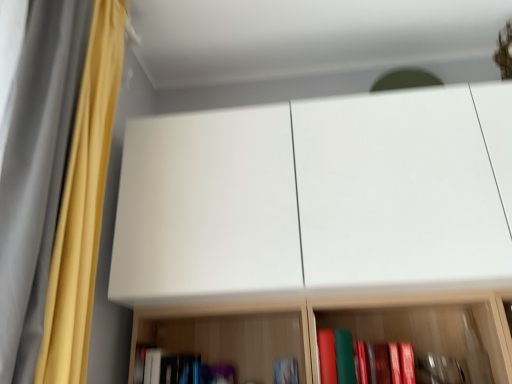
Question: Can you confirm if hardcover book at lower center, the first book from the right, is smaller than yellow fabric curtain at left, positioned as the 1th curtain in back-to-front order?

Choices:
 (A) yes
 (B) no

Answer: (A)

Question: Can you confirm if hardcover book at lower center, the 2th book viewed from the left, is positioned to the right of yellow fabric curtain at left, positioned as the 1th curtain in back-to-front order?

Choices:
 (A) no
 (B) yes

Answer: (B)

Question: From a real-world perspective, is hardcover book at lower center, the first book from the right, beneath yellow fabric curtain at left, positioned as the 1th curtain in back-to-front order?

Choices:
 (A) no
 (B) yes

Answer: (B)

Question: Can you confirm if hardcover book at lower center, the 2th book viewed from the left, is taller than yellow fabric curtain at left, positioned as the 1th curtain in back-to-front order?

Choices:
 (A) yes
 (B) no

Answer: (B)

Question: Is hardcover book at lower center, the 2th book viewed from the left, to the left of yellow fabric curtain at left, which is the 2th curtain in front-to-back order, from the viewer's perspective?

Choices:
 (A) yes
 (B) no

Answer: (B)

Question: From a real-world perspective, is white matte cabinet at upper center physically located above or below hardcover book at lower center, arranged as the first book when viewed from the left?

Choices:
 (A) below
 (B) above

Answer: (B)

Question: Based on their sizes in the image, would you say white matte cabinet at upper center is bigger or smaller than hardcover book at lower center, arranged as the first book when viewed from the left?

Choices:
 (A) small
 (B) big

Answer: (B)

Question: Choose the correct answer: Is white matte cabinet at upper center inside hardcover book at lower center, arranged as the first book when viewed from the left, or outside it?

Choices:
 (A) outside
 (B) inside

Answer: (A)

Question: Is white matte cabinet at upper center taller or shorter than hardcover book at lower center, acting as the second book starting from the right?

Choices:
 (A) short
 (B) tall

Answer: (B)

Question: Would you say hardcover book at lower center, the 2th book viewed from the left, is inside or outside white matte cabinet at upper center?

Choices:
 (A) inside
 (B) outside

Answer: (B)

Question: Is hardcover book at lower center, the 2th book viewed from the left, in front of or behind white matte cabinet at upper center in the image?

Choices:
 (A) front
 (B) behind

Answer: (B)

Question: Visually, is hardcover book at lower center, the first book from the right, positioned to the left or to the right of white matte cabinet at upper center?

Choices:
 (A) right
 (B) left

Answer: (B)

Question: From the image's perspective, is hardcover book at lower center, the 2th book viewed from the left, positioned above or below white matte cabinet at upper center?

Choices:
 (A) below
 (B) above

Answer: (A)

Question: Considering the relative positions of hardcover book at lower center, arranged as the first book when viewed from the left, and yellow fabric curtain at left, positioned as the 1th curtain in back-to-front order, in the image provided, is hardcover book at lower center, arranged as the first book when viewed from the left, to the left or to the right of yellow fabric curtain at left, positioned as the 1th curtain in back-to-front order,?

Choices:
 (A) left
 (B) right

Answer: (B)

Question: From a real-world perspective, relative to yellow fabric curtain at left, which is the 2th curtain in front-to-back order, is hardcover book at lower center, acting as the second book starting from the right, vertically above or below?

Choices:
 (A) below
 (B) above

Answer: (A)